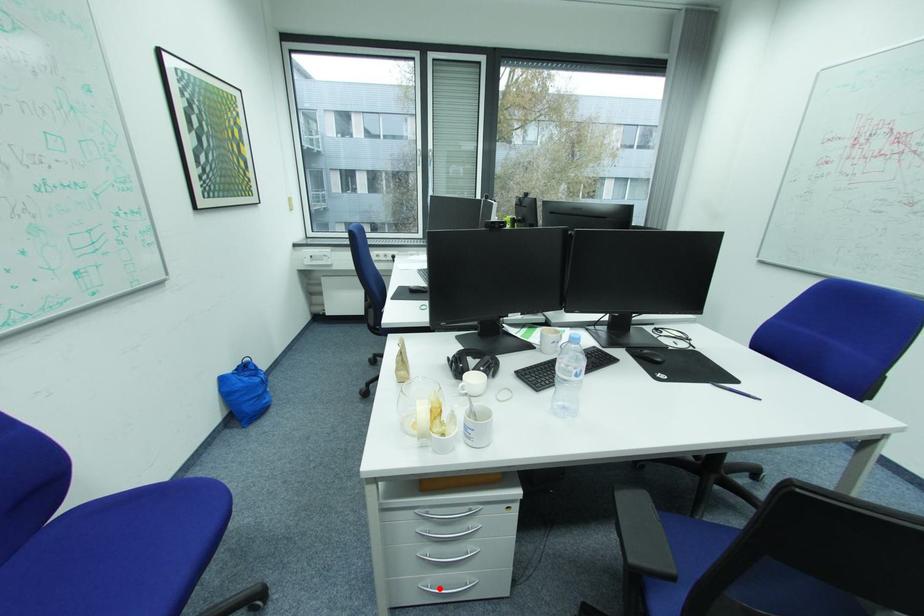
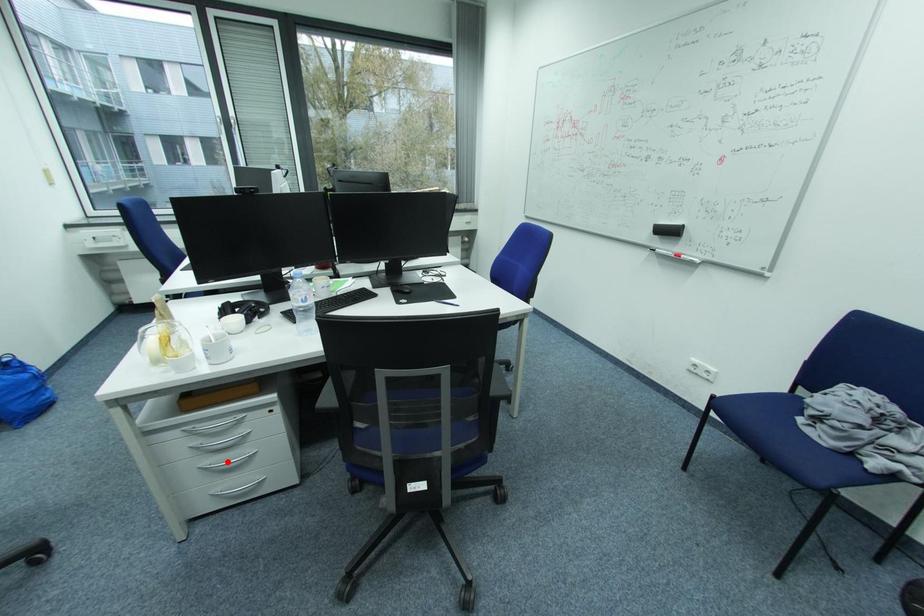
I am providing you with two images of the same scene from different viewpoints. A red point is marked on the first image and another point is marked on the second image. Are the points marked in image1 and image2 representing the same 3D position?

No